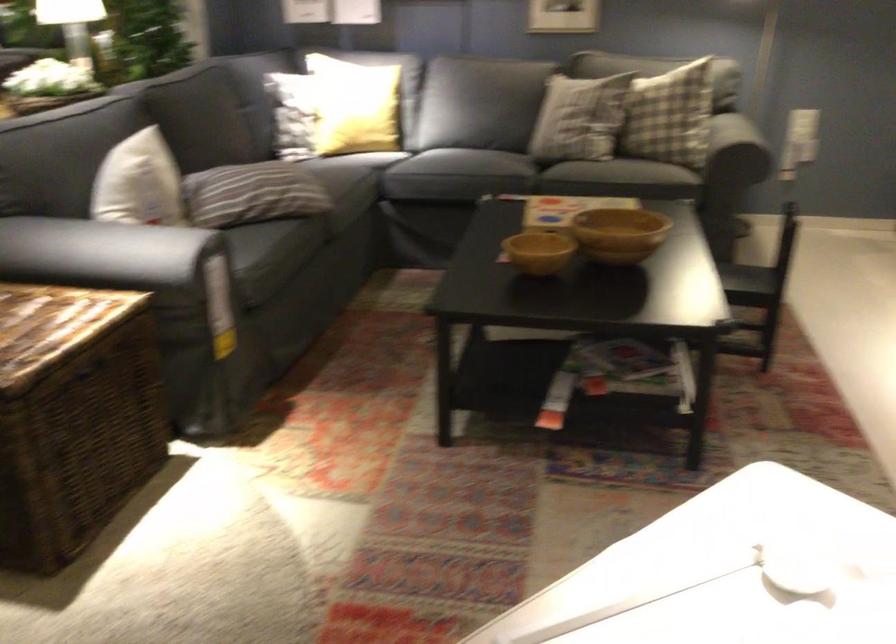
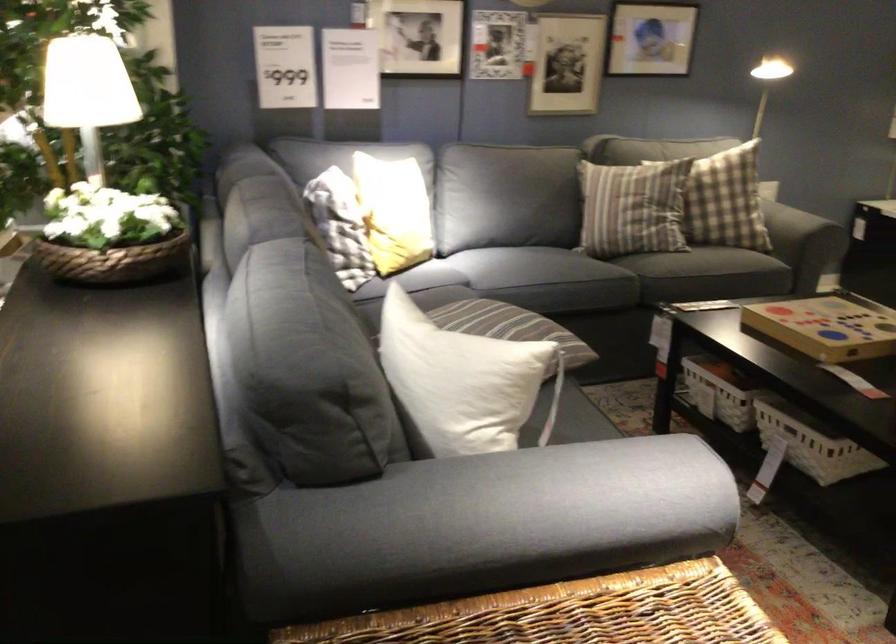
Find the pixel in the second image that matches point (114, 192) in the first image.

(462, 381)